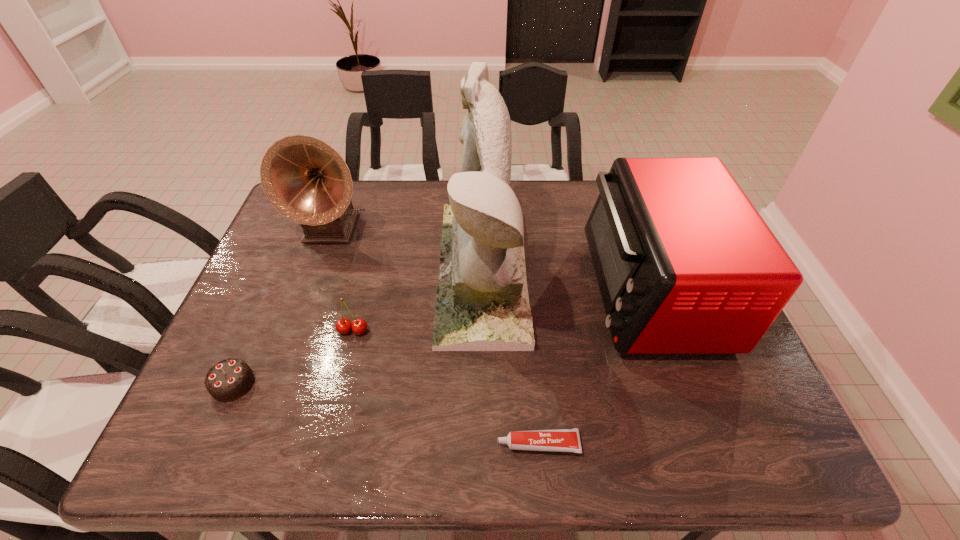
Find the location of `vacant space at the near left corner`. vacant space at the near left corner is located at coordinates (248, 431).

Find the location of `free spot at the near right corner of the desktop`. free spot at the near right corner of the desktop is located at coordinates (x=733, y=420).

Identify the location of free spot between the cherry and the second nearest object. (293, 357).

Locate an element on the screen. This screenshot has height=540, width=960. free area in between the rightmost object and the sculpture is located at coordinates (566, 281).

Locate an element on the screen. free space that is in between the second nearest object and the toothpaste is located at coordinates (386, 414).

At what (x,y) coordinates should I click in order to perform the action: click on free point between the shortest object and the third tallest object. Please return your answer as a coordinate pair (x, y). Looking at the image, I should click on (594, 367).

Where is `object that can be found as the second closest to the phonograph record`? This screenshot has height=540, width=960. object that can be found as the second closest to the phonograph record is located at coordinates (359, 326).

Identify which object is located as the fifth nearest to the rightmost object. Please provide its 2D coordinates. Your answer should be formatted as a tuple, i.e. [(x, y)], where the tuple contains the x and y coordinates of a point satisfying the conditions above.

[(229, 379)]

Image resolution: width=960 pixels, height=540 pixels. Find the location of `free space that satisfies the following two spatial constraints: 1. on the front-facing side of the fourth shortest object; 2. with the stems of the cherry pointing upwards`. free space that satisfies the following two spatial constraints: 1. on the front-facing side of the fourth shortest object; 2. with the stems of the cherry pointing upwards is located at coordinates (664, 330).

You are a GUI agent. You are given a task and a screenshot of the screen. Output one action in this format:
    pyautogui.click(x=<x>, y=<y>)
    Task: Click on the free space that satisfies the following two spatial constraints: 1. on the front-facing side of the toaster oven; 2. on the front side of the chocolate cake
    The width and height of the screenshot is (960, 540).
    Given the screenshot: What is the action you would take?
    pyautogui.click(x=684, y=384)